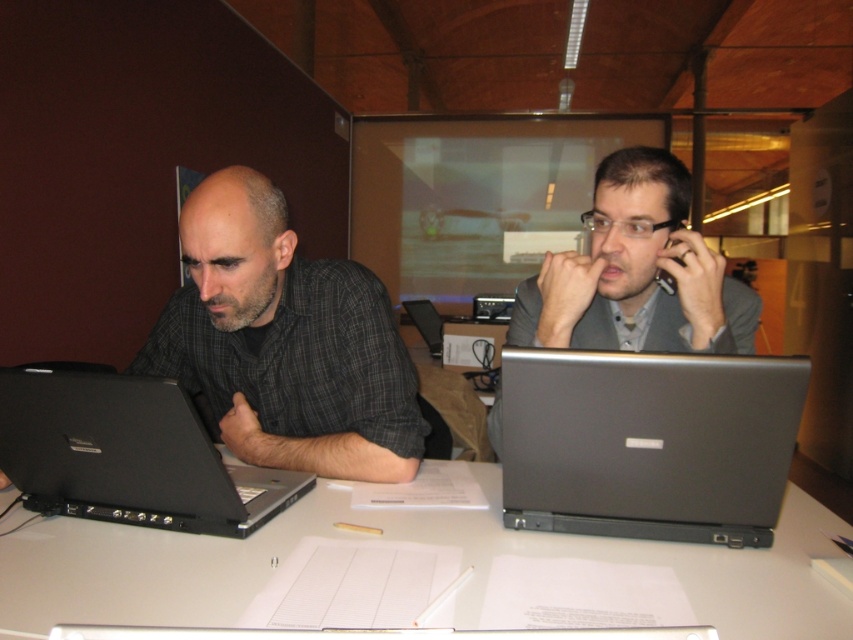
You are a photographer standing behind the two people at the table. You want to take a photo that includes both the matte black shirt at left and the matte gray suit at right. Which person should you position closer to the camera to ensure both are fully visible in the frame?

The matte black shirt at left is taller than the matte gray suit at right. To ensure both are fully visible in the frame, position the matte gray suit at right closer to the camera since it is shorter and requires less vertical space.

You are standing in front of the table and want to place a small object on the table. Which point, point [595,428] or point [30,429], is closer to you?

Point [595,428] is closer to the viewer than point [30,429], so you should place the object there if you want it closer to you.